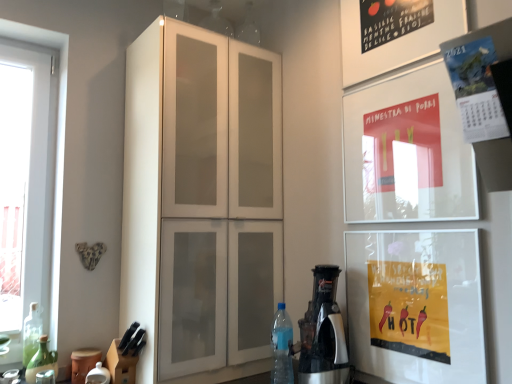
Question: Does green glass bottle at lower left, the first bottle positioned from the left, appear on the left side of silver metallic coffee machine at lower right?

Choices:
 (A) yes
 (B) no

Answer: (A)

Question: From the image's perspective, is green glass bottle at lower left, the first bottle positioned from the left, on top of silver metallic coffee machine at lower right?

Choices:
 (A) no
 (B) yes

Answer: (A)

Question: Is green glass bottle at lower left, the 3th bottle positioned from the right, turned away from silver metallic coffee machine at lower right?

Choices:
 (A) yes
 (B) no

Answer: (B)

Question: Does green glass bottle at lower left, the 3th bottle positioned from the right, have a greater height compared to silver metallic coffee machine at lower right?

Choices:
 (A) yes
 (B) no

Answer: (B)

Question: Is green glass bottle at lower left, the first bottle positioned from the left, outside of silver metallic coffee machine at lower right?

Choices:
 (A) no
 (B) yes

Answer: (B)

Question: From the image's perspective, is blue translucent bottle at lower right, the 3th bottle viewed from the left, positioned above or below white glass window at left?

Choices:
 (A) below
 (B) above

Answer: (A)

Question: From a real-world perspective, is blue translucent bottle at lower right, the 3th bottle viewed from the left, positioned above or below white glass window at left?

Choices:
 (A) below
 (B) above

Answer: (A)

Question: Is blue translucent bottle at lower right, the 3th bottle viewed from the left, situated inside white glass window at left or outside?

Choices:
 (A) outside
 (B) inside

Answer: (A)

Question: Is blue translucent bottle at lower right, the 3th bottle viewed from the left, in front of or behind white glass window at left in the image?

Choices:
 (A) behind
 (B) front

Answer: (A)

Question: Is white matte cabinet at center bigger or smaller than green glass bottle at left, the 2th bottle when ordered from left to right?

Choices:
 (A) small
 (B) big

Answer: (B)

Question: Does point (204, 82) appear closer or farther from the camera than point (39, 339)?

Choices:
 (A) farther
 (B) closer

Answer: (B)

Question: From a real-world perspective, relative to green glass bottle at left, the second bottle when ordered from right to left, is white matte cabinet at center vertically above or below?

Choices:
 (A) below
 (B) above

Answer: (B)

Question: Is white matte cabinet at center wider or thinner than green glass bottle at left, the 2th bottle when ordered from left to right?

Choices:
 (A) wide
 (B) thin

Answer: (A)

Question: Which is correct: blue translucent bottle at lower right, the 3th bottle viewed from the left, is inside green glass bottle at lower left, the 3th bottle positioned from the right, or outside of it?

Choices:
 (A) outside
 (B) inside

Answer: (A)

Question: In the image, is blue translucent bottle at lower right, the 3th bottle viewed from the left, positioned in front of or behind green glass bottle at lower left, the first bottle positioned from the left?

Choices:
 (A) front
 (B) behind

Answer: (B)